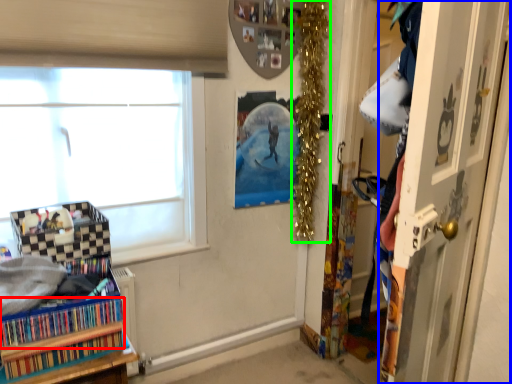
Question: Which object is the farthest from book (highlighted by a red box)? Choose among these: door (highlighted by a blue box) or christmas decoration (highlighted by a green box).

Choices:
 (A) door
 (B) christmas decoration

Answer: (B)